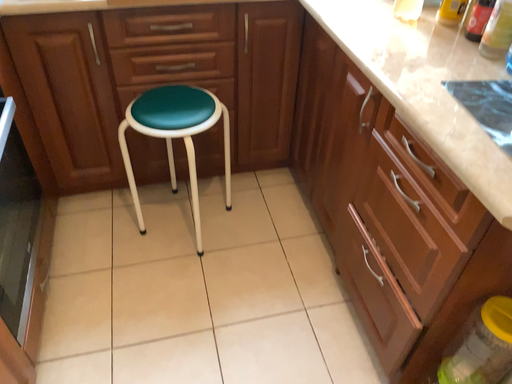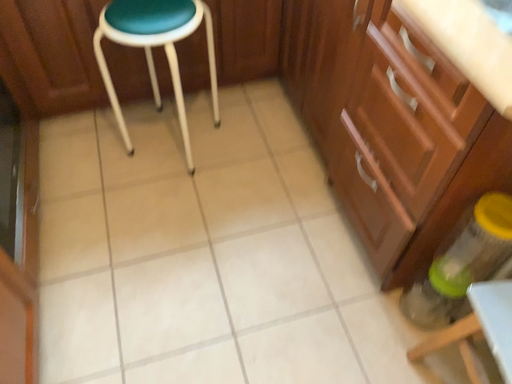
Question: Which way did the camera rotate in the video?

Choices:
 (A) rotated downward
 (B) rotated upward

Answer: (A)